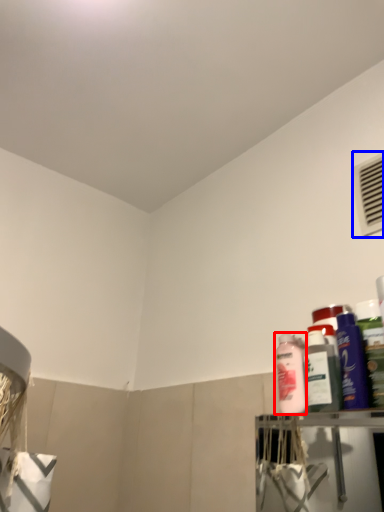
Question: Which of the following is the closest to the observer, cleaning product (highlighted by a red box) or air conditioning (highlighted by a blue box)?

Choices:
 (A) cleaning product
 (B) air conditioning

Answer: (A)